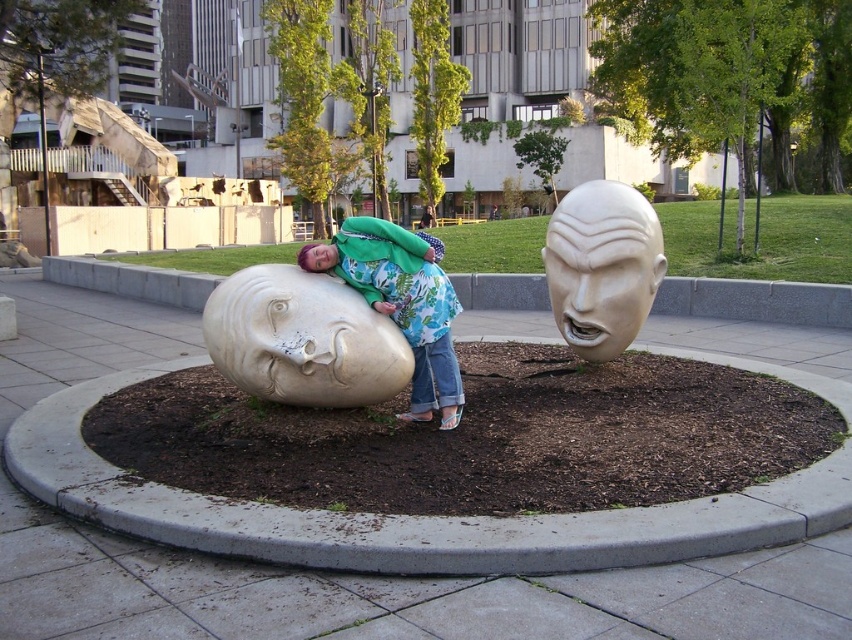
Does point (255, 387) lie behind point (376, 289)?

No, (255, 387) is closer to viewer.

Is point (269, 380) in front of point (412, 291)?

Yes, point (269, 380) is closer to viewer.

Between point (384, 396) and point (441, 388), which one is positioned in front?

Point (384, 396) is in front.

This screenshot has height=640, width=852. I want to click on matte white stone head at center, so click(x=303, y=339).

Between white marble head at upper right and matte green jacket at center, which one is positioned higher?

white marble head at upper right is higher up.

What do you see at coordinates (602, 266) in the screenshot? The image size is (852, 640). I see `white marble head at upper right` at bounding box center [602, 266].

This screenshot has width=852, height=640. Identify the location of white marble head at upper right. (602, 266).

Does matte white stone head at center have a smaller size compared to white marble head at upper right?

Yes, matte white stone head at center is smaller than white marble head at upper right.

Who is more forward, (x=343, y=372) or (x=560, y=269)?

Point (x=343, y=372)

Image resolution: width=852 pixels, height=640 pixels. I want to click on matte white stone head at center, so click(x=303, y=339).